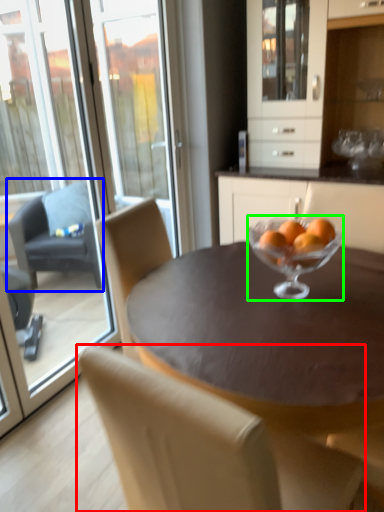
Question: Which is nearer to the chair (highlighted by a red box)? chair (highlighted by a blue box) or martini glass (highlighted by a green box).

Choices:
 (A) chair
 (B) martini glass

Answer: (B)